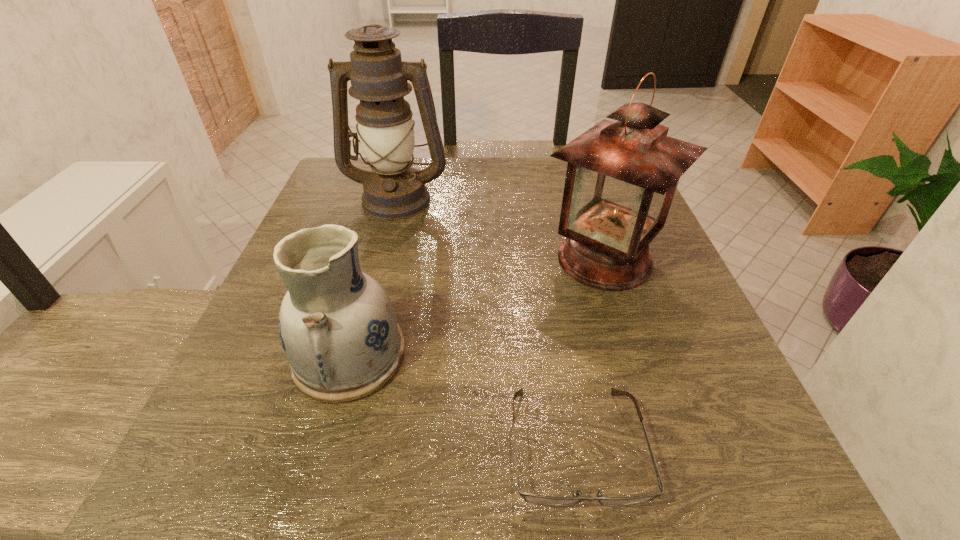
I want to click on the third closest object relative to the pottery, so click(394, 190).

You are a GUI agent. You are given a task and a screenshot of the screen. Output one action in this format:
    pyautogui.click(x=<x>, y=<y>)
    Task: Click on the object that is the third closest to the pottery
    
    Given the screenshot: What is the action you would take?
    pyautogui.click(x=394, y=190)

Find the location of `free space that satisfies the following two spatial constraints: 1. on the front side of the nearer oil lamp; 2. on the left side of the farthest object`. free space that satisfies the following two spatial constraints: 1. on the front side of the nearer oil lamp; 2. on the left side of the farthest object is located at coordinates (381, 259).